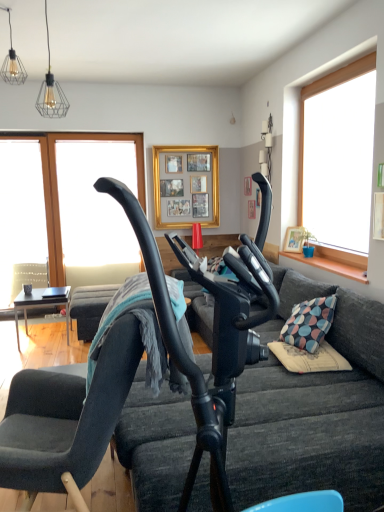
Describe the element at coordinates (186, 186) in the screenshot. The height and width of the screenshot is (512, 384). I see `gold/gilded picture frame at upper center` at that location.

This screenshot has width=384, height=512. What are the coordinates of `gold/gilded picture frame at upper center` in the screenshot? It's located at (186, 186).

In order to click on transparent glass window at left, marked as the second window screen in a right-to-left arrangement in this screenshot , I will do `click(22, 219)`.

What do you see at coordinates (22, 219) in the screenshot?
I see `transparent glass window at left, marked as the second window screen in a right-to-left arrangement` at bounding box center [22, 219].

Describe the element at coordinates (95, 202) in the screenshot. Image resolution: width=384 pixels, height=512 pixels. I see `transparent glass window at upper left, positioned as the 1th window screen in right-to-left order` at that location.

You are a GUI agent. You are given a task and a screenshot of the screen. Output one action in this format:
    pyautogui.click(x=<x>, y=<y>)
    Task: Click on the velvet dark gray chair at center
    
    Given the screenshot: What is the action you would take?
    pyautogui.click(x=82, y=421)

Locate an element on the screen. This screenshot has height=512, width=384. dark gray fabric couch at center is located at coordinates (312, 410).

Locate an element on the screen. The width and height of the screenshot is (384, 512). gold/gilded picture frame at upper center is located at coordinates (186, 186).

From a real-world perspective, is dark gray fabric couch at center physically located above or below velvet dark gray chair at center?

In terms of real-world spatial position, dark gray fabric couch at center is above velvet dark gray chair at center.

Is the surface of dark gray fabric couch at center in direct contact with velvet dark gray chair at center?

There is a gap between dark gray fabric couch at center and velvet dark gray chair at center.

Does dark gray fabric couch at center have a greater height compared to velvet dark gray chair at center?

Indeed, dark gray fabric couch at center has a greater height compared to velvet dark gray chair at center.

Which object is more forward, dark gray fabric couch at center or velvet dark gray chair at center?

dark gray fabric couch at center is closer to the camera.

Who is smaller, dark gray fabric couch at center or transparent glass window at left, which appears as the 1th window screen when viewed from the left?

transparent glass window at left, which appears as the 1th window screen when viewed from the left.

Which object is positioned more to the left, dark gray fabric couch at center or transparent glass window at left, marked as the second window screen in a right-to-left arrangement?

transparent glass window at left, marked as the second window screen in a right-to-left arrangement.

How far apart are dark gray fabric couch at center and transparent glass window at left, marked as the second window screen in a right-to-left arrangement?

dark gray fabric couch at center is 3.66 meters from transparent glass window at left, marked as the second window screen in a right-to-left arrangement.

Is dark gray fabric couch at center completely or partially outside of transparent glass window at left, marked as the second window screen in a right-to-left arrangement?

dark gray fabric couch at center is positioned outside transparent glass window at left, marked as the second window screen in a right-to-left arrangement.

Considering the relative sizes of gold/gilded picture frame at upper center and transparent glass window at left, marked as the second window screen in a right-to-left arrangement, in the image provided, is gold/gilded picture frame at upper center bigger than transparent glass window at left, marked as the second window screen in a right-to-left arrangement,?

No.

Is gold/gilded picture frame at upper center inside the boundaries of transparent glass window at left, marked as the second window screen in a right-to-left arrangement, or outside?

gold/gilded picture frame at upper center exists outside the volume of transparent glass window at left, marked as the second window screen in a right-to-left arrangement.

From a real-world perspective, between gold/gilded picture frame at upper center and transparent glass window at left, which appears as the 1th window screen when viewed from the left, who is vertically higher?

gold/gilded picture frame at upper center.

From the image's perspective, between gold/gilded picture frame at upper center and transparent glass window at left, which appears as the 1th window screen when viewed from the left, who is located below?

transparent glass window at left, which appears as the 1th window screen when viewed from the left, appears lower in the image.

Is point (43, 273) in front of point (8, 473)?

No, (43, 273) is behind (8, 473).

Is transparent glass window at left, which appears as the 1th window screen when viewed from the left, far from velvet dark gray chair at center?

Absolutely, transparent glass window at left, which appears as the 1th window screen when viewed from the left, is distant from velvet dark gray chair at center.

Considering their positions, is transparent glass window at left, which appears as the 1th window screen when viewed from the left, located in front of or behind velvet dark gray chair at center?

transparent glass window at left, which appears as the 1th window screen when viewed from the left, is behind velvet dark gray chair at center.

Considering the sizes of transparent glass window at left, which appears as the 1th window screen when viewed from the left, and velvet dark gray chair at center in the image, is transparent glass window at left, which appears as the 1th window screen when viewed from the left, wider or thinner than velvet dark gray chair at center?

transparent glass window at left, which appears as the 1th window screen when viewed from the left, is thinner than velvet dark gray chair at center.

Is transparent glass window at left, marked as the second window screen in a right-to-left arrangement, looking in the opposite direction of transparent glass window at upper left, which ranks as the second window screen in left-to-right order?

No, transparent glass window at upper left, which ranks as the second window screen in left-to-right order, is not at the back of transparent glass window at left, marked as the second window screen in a right-to-left arrangement.

Would you say transparent glass window at left, marked as the second window screen in a right-to-left arrangement, is to the left or to the right of transparent glass window at upper left, positioned as the 1th window screen in right-to-left order, in the picture?

From the image, it's evident that transparent glass window at left, marked as the second window screen in a right-to-left arrangement, is to the left of transparent glass window at upper left, positioned as the 1th window screen in right-to-left order.

Is transparent glass window at left, which appears as the 1th window screen when viewed from the left, positioned beyond the bounds of transparent glass window at upper left, which ranks as the second window screen in left-to-right order?

transparent glass window at left, which appears as the 1th window screen when viewed from the left, is positioned outside transparent glass window at upper left, which ranks as the second window screen in left-to-right order.

Considering the positions of objects gold/gilded picture frame at upper center and velvet dark gray chair at center in the image provided, who is more to the right, gold/gilded picture frame at upper center or velvet dark gray chair at center?

Positioned to the right is gold/gilded picture frame at upper center.

Which of these two, gold/gilded picture frame at upper center or velvet dark gray chair at center, stands shorter?

Standing shorter between the two is gold/gilded picture frame at upper center.

From a real-world perspective, who is located higher, gold/gilded picture frame at upper center or velvet dark gray chair at center?

In real-world perspective, gold/gilded picture frame at upper center is above.

Consider the image. Can we say gold/gilded picture frame at upper center lies outside velvet dark gray chair at center?

Absolutely, gold/gilded picture frame at upper center is external to velvet dark gray chair at center.

Is transparent glass window at left, which appears as the 1th window screen when viewed from the left, at the right side of dark gray fabric couch at center?

No.

Is transparent glass window at left, which appears as the 1th window screen when viewed from the left, taller or shorter than dark gray fabric couch at center?

In the image, transparent glass window at left, which appears as the 1th window screen when viewed from the left, appears to be taller than dark gray fabric couch at center.

From the image's perspective, is transparent glass window at left, which appears as the 1th window screen when viewed from the left, on dark gray fabric couch at center?

Yes.

Is transparent glass window at left, which appears as the 1th window screen when viewed from the left, oriented towards dark gray fabric couch at center?

No.

Locate an element on the screen. This screenshot has height=512, width=384. chair that appears below the dark gray fabric couch at center (from the image's perspective) is located at coordinates (82, 421).

You are a GUI agent. You are given a task and a screenshot of the screen. Output one action in this format:
    pyautogui.click(x=<x>, y=<y>)
    Task: Click on the studio couch that appears on the right of transparent glass window at left, which appears as the 1th window screen when viewed from the left
    
    Given the screenshot: What is the action you would take?
    pyautogui.click(x=312, y=410)

When comparing their distances from gold/gilded picture frame at upper center, does dark gray fabric couch at center or transparent glass window at left, marked as the second window screen in a right-to-left arrangement, seem closer?

Among the two, transparent glass window at left, marked as the second window screen in a right-to-left arrangement, is located nearer to gold/gilded picture frame at upper center.

Considering their positions, is gold/gilded picture frame at upper center positioned further to transparent glass window at left, marked as the second window screen in a right-to-left arrangement, than dark gray fabric couch at center?

dark gray fabric couch at center is further to transparent glass window at left, marked as the second window screen in a right-to-left arrangement.

Which object lies nearer to the anchor point black matte table at left, gold/gilded picture frame at upper center or transparent glass window at upper left, positioned as the 1th window screen in right-to-left order?

transparent glass window at upper left, positioned as the 1th window screen in right-to-left order, is positioned closer to the anchor black matte table at left.

Based on the photo, which object lies further to the anchor point transparent glass window at upper left, which ranks as the second window screen in left-to-right order, transparent glass window at left, marked as the second window screen in a right-to-left arrangement, or dark gray fabric couch at center?

dark gray fabric couch at center is further to transparent glass window at upper left, which ranks as the second window screen in left-to-right order.

Estimate the real-world distances between objects in this image. Which object is further from transparent glass window at upper left, positioned as the 1th window screen in right-to-left order, velvet dark gray chair at center or black matte table at left?

The object further to transparent glass window at upper left, positioned as the 1th window screen in right-to-left order, is velvet dark gray chair at center.

Looking at the image, which one is located closer to black matte table at left, velvet dark gray chair at center or gold/gilded picture frame at upper center?

gold/gilded picture frame at upper center is positioned closer to the anchor black matte table at left.

Which object lies nearer to the anchor point dark gray fabric couch at center, velvet dark gray chair at center or transparent glass window at upper left, which ranks as the second window screen in left-to-right order?

velvet dark gray chair at center.

Based on their spatial positions, is transparent glass window at left, which appears as the 1th window screen when viewed from the left, or transparent glass window at upper left, which ranks as the second window screen in left-to-right order, closer to dark gray fabric couch at center?

Among the two, transparent glass window at upper left, which ranks as the second window screen in left-to-right order, is located nearer to dark gray fabric couch at center.

Where is `chair between dark gray fabric couch at center and transparent glass window at left, which appears as the 1th window screen when viewed from the left, in the front-back direction`? chair between dark gray fabric couch at center and transparent glass window at left, which appears as the 1th window screen when viewed from the left, in the front-back direction is located at coordinates (82, 421).

What are the coordinates of `table between transparent glass window at left, marked as the second window screen in a right-to-left arrangement, and gold/gilded picture frame at upper center, in the horizontal direction` in the screenshot? It's located at (41, 305).

Where is `table positioned between velvet dark gray chair at center and transparent glass window at upper left, which ranks as the second window screen in left-to-right order, from near to far`? This screenshot has height=512, width=384. table positioned between velvet dark gray chair at center and transparent glass window at upper left, which ranks as the second window screen in left-to-right order, from near to far is located at coordinates (41, 305).

Find the location of a particular element. The height and width of the screenshot is (512, 384). window screen between transparent glass window at upper left, which ranks as the second window screen in left-to-right order, and black matte table at left vertically is located at coordinates (22, 219).